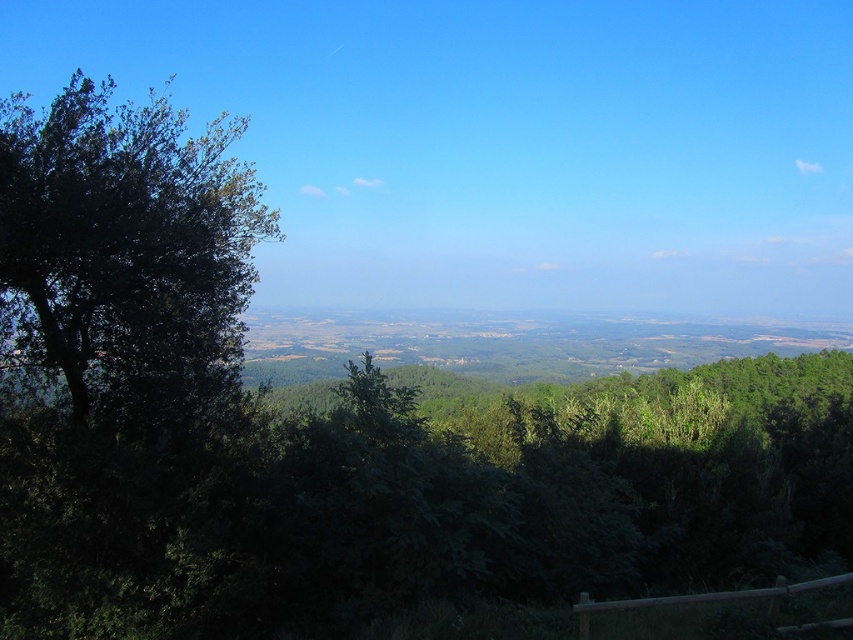
Does green leafy tree at left have a larger size compared to dark green leafy tree at left?

No, green leafy tree at left is not bigger than dark green leafy tree at left.

Locate an element on the screen. The image size is (853, 640). green leafy tree at left is located at coordinates (415, 506).

Identify the location of green leafy tree at left. (415, 506).